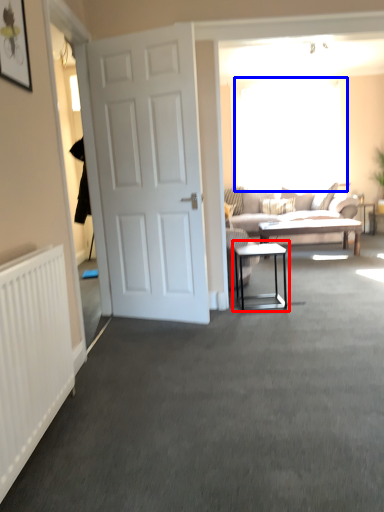
Question: Which of the following is the farthest to the observer, table (highlighted by a red box) or window screen (highlighted by a blue box)?

Choices:
 (A) table
 (B) window screen

Answer: (B)